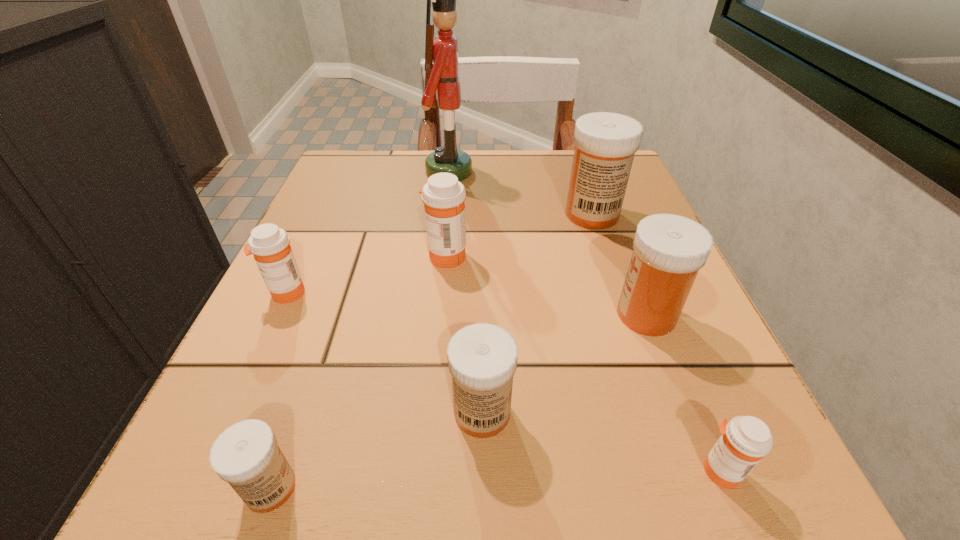
I want to click on vacant space in between the second orange medicine from left to right and the nearest white medicine, so click(358, 372).

The height and width of the screenshot is (540, 960). I want to click on blank region between the tallest medicine and the second object from left to right, so click(x=431, y=351).

Image resolution: width=960 pixels, height=540 pixels. Identify the location of vacant point located between the rightmost orange medicine and the biggest orange medicine. (583, 363).

Locate which object is the second closest to the smallest white medicine. Please provide its 2D coordinates. Your answer should be formatted as a tuple, i.e. [(x, y)], where the tuple contains the x and y coordinates of a point satisfying the conditions above.

[(270, 245)]

Point out which object is positioned as the seventh nearest to the second nearest white medicine. Please provide its 2D coordinates. Your answer should be formatted as a tuple, i.e. [(x, y)], where the tuple contains the x and y coordinates of a point satisfying the conditions above.

[(441, 53)]

Locate an element on the screen. the fourth closest medicine relative to the second smallest white medicine is located at coordinates tap(443, 195).

Where is `medicine that stands as the closest to the leftmost white medicine`? The height and width of the screenshot is (540, 960). medicine that stands as the closest to the leftmost white medicine is located at coordinates (482, 358).

Choose which white medicine is the third nearest neighbor to the leftmost orange medicine. Please provide its 2D coordinates. Your answer should be formatted as a tuple, i.e. [(x, y)], where the tuple contains the x and y coordinates of a point satisfying the conditions above.

[(605, 143)]

The image size is (960, 540). I want to click on the fourth closest white medicine relative to the rightmost orange medicine, so [246, 455].

The image size is (960, 540). Identify the location of orange medicine that is the closest to the second farthest white medicine. (745, 440).